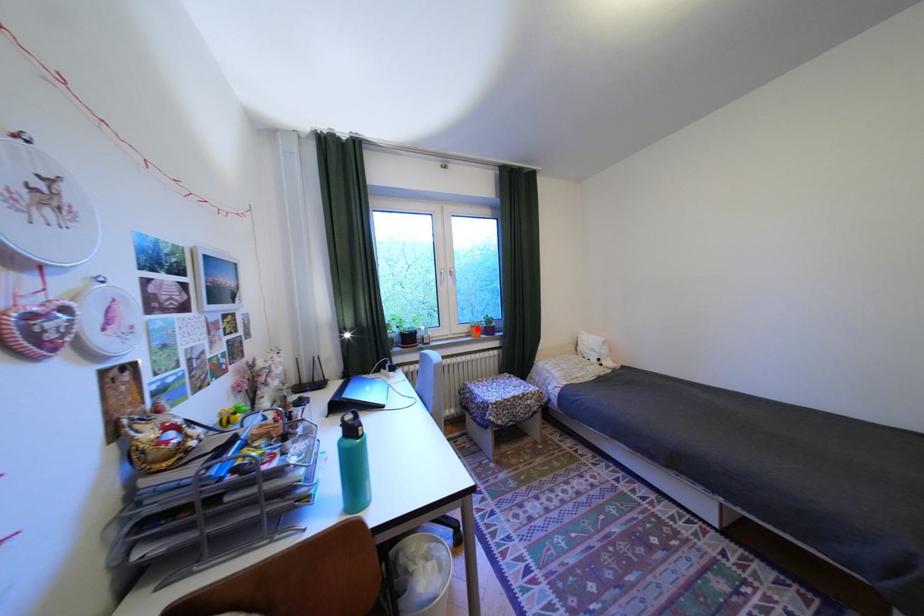
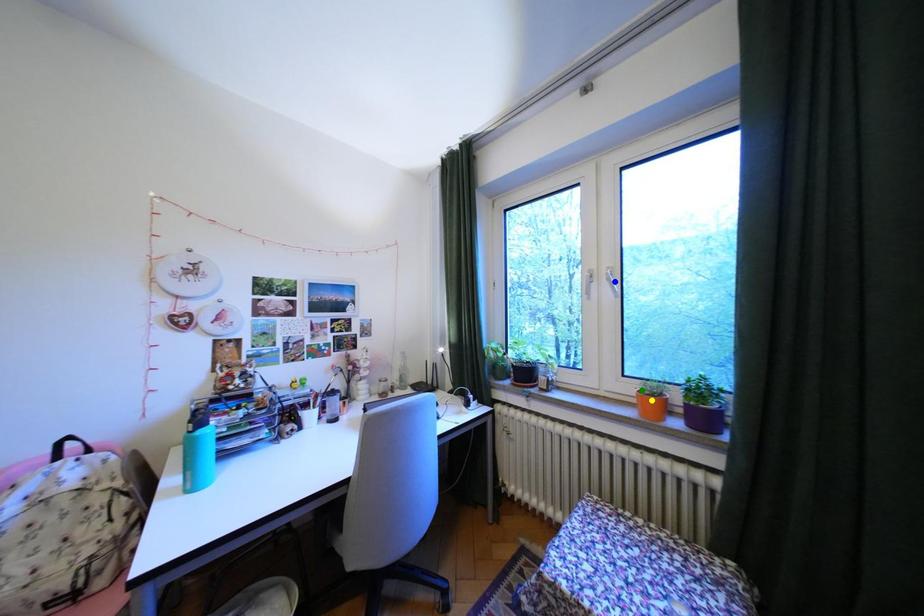
Question: I am providing you with two images of the same scene from different viewpoints. A red point is marked on the first image. You are given multiple points on the second image. In image 2, which mark is for the same physical point as the one in image 1?

Choices:
 (A) green point
 (B) blue point
 (C) yellow point

Answer: (A)